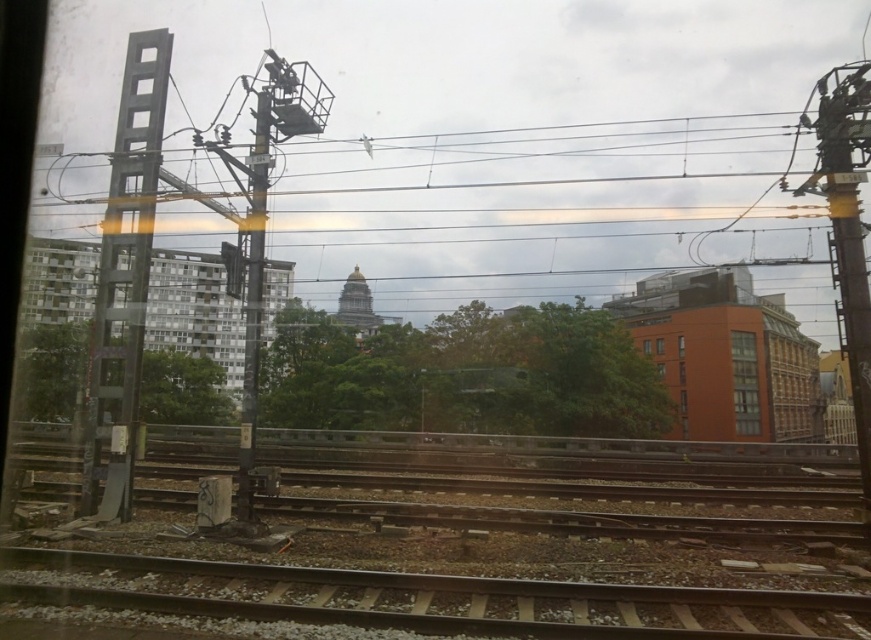
Question: Can you confirm if matte glass windows at center is bigger than matte orange window at center-right?

Choices:
 (A) no
 (B) yes

Answer: (A)

Question: Which of these objects is positioned farthest from the matte orange window at center-right?

Choices:
 (A) metallic gray pole at left
 (B) metallic gray pole at center-left

Answer: (B)

Question: Can you confirm if metallic gray pole at left is positioned above matte orange window at center-right?

Choices:
 (A) no
 (B) yes

Answer: (A)

Question: Which of the following is the closest to the observer?

Choices:
 (A) (647, 352)
 (B) (659, 344)
 (C) (250, 397)
 (D) (733, 356)

Answer: (C)

Question: Is metallic gray pole at left to the right of clear glass window at center from the viewer's perspective?

Choices:
 (A) yes
 (B) no

Answer: (B)

Question: Which object is farther from the camera taking this photo?

Choices:
 (A) metallic gray pole at left
 (B) metallic gray pole at center-left
 (C) transparent glass window at center
 (D) matte orange window at center-right

Answer: (C)